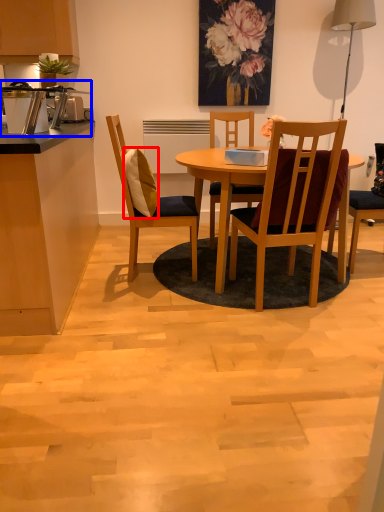
Question: Which object is closer to the camera taking this photo, pillow (highlighted by a red box) or appliance (highlighted by a blue box)?

Choices:
 (A) pillow
 (B) appliance

Answer: (B)